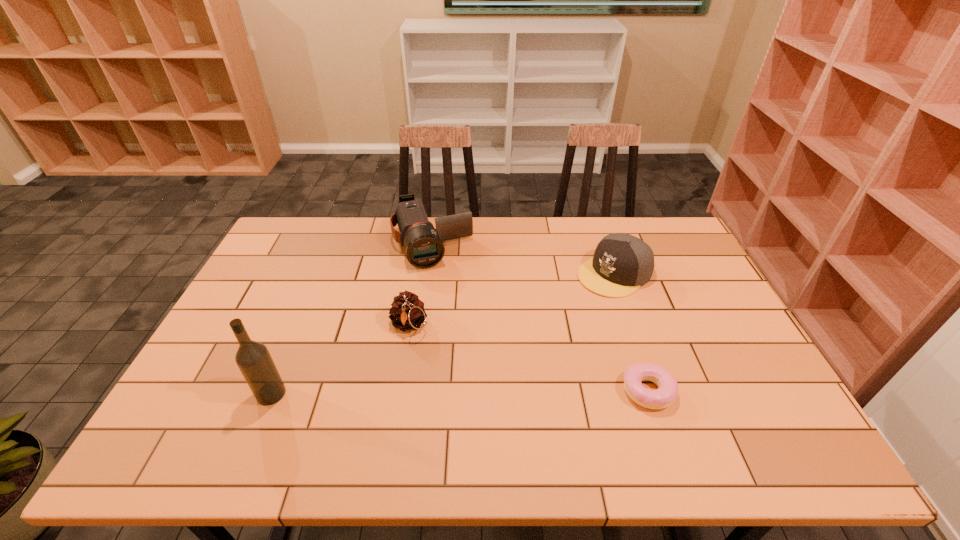
You are a GUI agent. You are given a task and a screenshot of the screen. Output one action in this format:
    pyautogui.click(x=<x>, y=<y>)
    Task: Click on the vacant space situated on the front-facing side of the cap
    
    Given the screenshot: What is the action you would take?
    pyautogui.click(x=513, y=336)

The height and width of the screenshot is (540, 960). Find the location of `vacant region located on the lens of the camcorder`. vacant region located on the lens of the camcorder is located at coordinates (469, 351).

Where is `vacant area situated 0.180m on the lens of the camcorder`? The height and width of the screenshot is (540, 960). vacant area situated 0.180m on the lens of the camcorder is located at coordinates (454, 308).

I want to click on free space located on the lens of the camcorder, so click(458, 318).

Identify the location of vacant space situated with a leaf charm attached to the third farthest object. The image size is (960, 540). (407, 407).

I want to click on vacant position located 0.120m with a leaf charm attached to the third farthest object, so click(408, 377).

Where is `free location located 0.150m with a leaf charm attached to the third farthest object`? free location located 0.150m with a leaf charm attached to the third farthest object is located at coordinates (408, 387).

This screenshot has width=960, height=540. I want to click on cap located at the far edge, so click(x=622, y=263).

Where is `camcorder that is at the far edge`? This screenshot has width=960, height=540. camcorder that is at the far edge is located at coordinates [423, 243].

Identify the location of vodka positioned at the near edge. (253, 359).